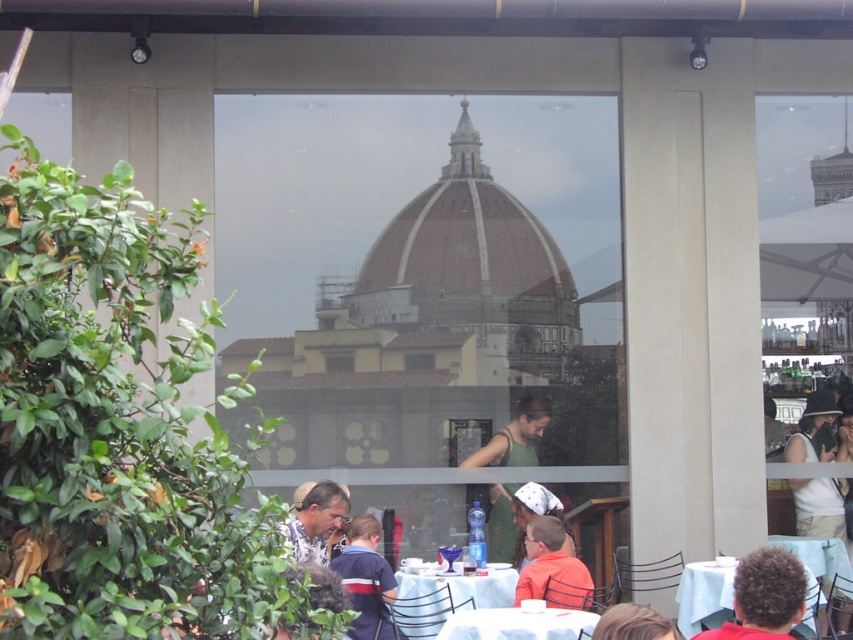
You are a photographer standing in the outdoor cafe and want to take a photo of both the point at coordinates point (332, 502) and the point at coordinates point (628, 618). Which point is closer to your camera?

Point (332, 502) is further to the camera than point (628, 618), so the point at coordinates point (628, 618) is closer to the camera.

You are a customer at the outdoor cafe and want to sit at the white glossy table at lower center. However, there is a white fabric headscarf at center. Can you sit there without moving the headscarf?

The white glossy table at lower center is positioned under the white fabric headscarf at center, so you can sit there without moving the headscarf as it is already above the table.

You are standing at the entrance of the outdoor cafe and want to see both the matte white tank top at center and the matte white shirt at lower center. Which one will appear closer to you?

The matte white tank top at center will appear closer to you because it is further to the viewer than the matte white shirt at lower center.